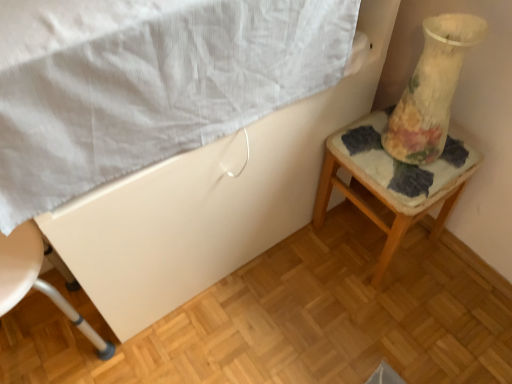
Question: Looking at the image, does white plastic chair at lower left seem bigger or smaller compared to floral fabric cushion at right?

Choices:
 (A) small
 (B) big

Answer: (A)

Question: Is white plastic chair at lower left in front of or behind floral fabric cushion at right in the image?

Choices:
 (A) front
 (B) behind

Answer: (A)

Question: Estimate the real-world distances between objects in this image. Which object is closer to the floral-patterned glass at right?

Choices:
 (A) floral fabric cushion at right
 (B) white plastic chair at lower left
 (C) white textured sheet at upper left

Answer: (A)

Question: Estimate the real-world distances between objects in this image. Which object is farther from the white plastic chair at lower left?

Choices:
 (A) floral-patterned glass at right
 (B) white textured sheet at upper left
 (C) floral fabric cushion at right

Answer: (A)